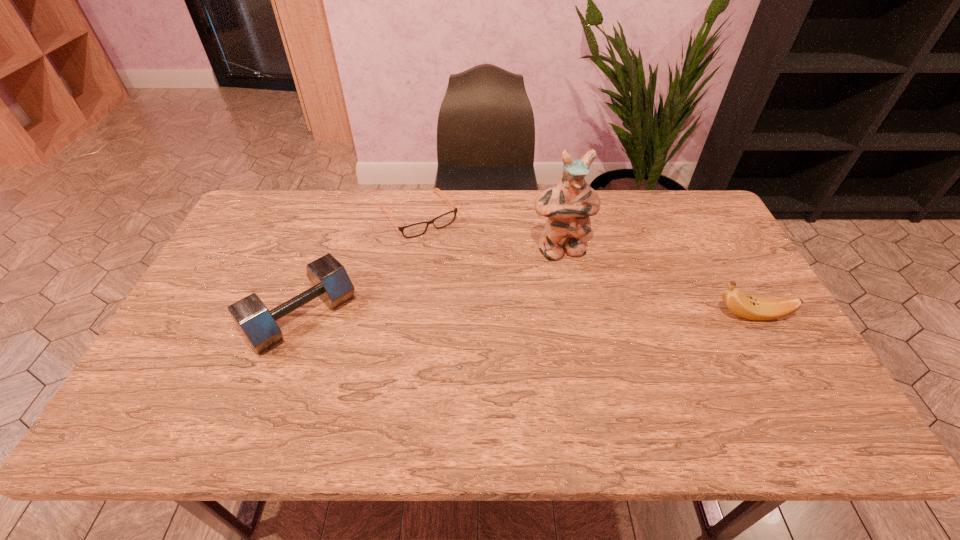
The width and height of the screenshot is (960, 540). In the image, there is a desktop. Identify the location of vacant region at the far right corner. (673, 225).

Where is `free space that is in between the shortest object and the rightmost object`? The height and width of the screenshot is (540, 960). free space that is in between the shortest object and the rightmost object is located at coordinates (585, 265).

Locate an element on the screen. This screenshot has height=540, width=960. free space between the figurine and the banana is located at coordinates point(656,283).

Where is `vacant area between the figurine and the shortest object`? This screenshot has width=960, height=540. vacant area between the figurine and the shortest object is located at coordinates (489, 233).

At what (x,y) coordinates should I click in order to perform the action: click on vacant area between the banana and the dumbbell. Please return your answer as a coordinate pair (x, y). The height and width of the screenshot is (540, 960). Looking at the image, I should click on (527, 316).

Find the location of a particular element. This screenshot has width=960, height=540. free space between the dumbbell and the figurine is located at coordinates (431, 284).

Where is `free space between the tallest object and the spectacles`? The height and width of the screenshot is (540, 960). free space between the tallest object and the spectacles is located at coordinates (489, 233).

Image resolution: width=960 pixels, height=540 pixels. I want to click on vacant area that lies between the rightmost object and the spectacles, so click(x=585, y=265).

The height and width of the screenshot is (540, 960). I want to click on vacant area that lies between the tallest object and the banana, so click(x=656, y=283).

Identify the location of vacant area between the dumbbell and the rightmost object. (527, 316).